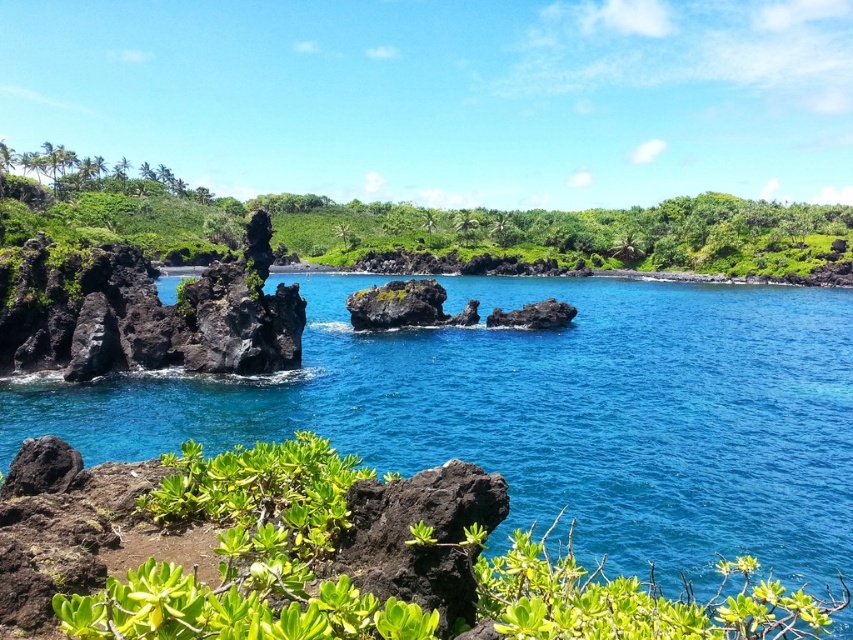
Based on the photo, you are standing at the point marked as point (419, 227) in the coastal landscape. What do you see around you?

You see green leafy shrubs at left around you.